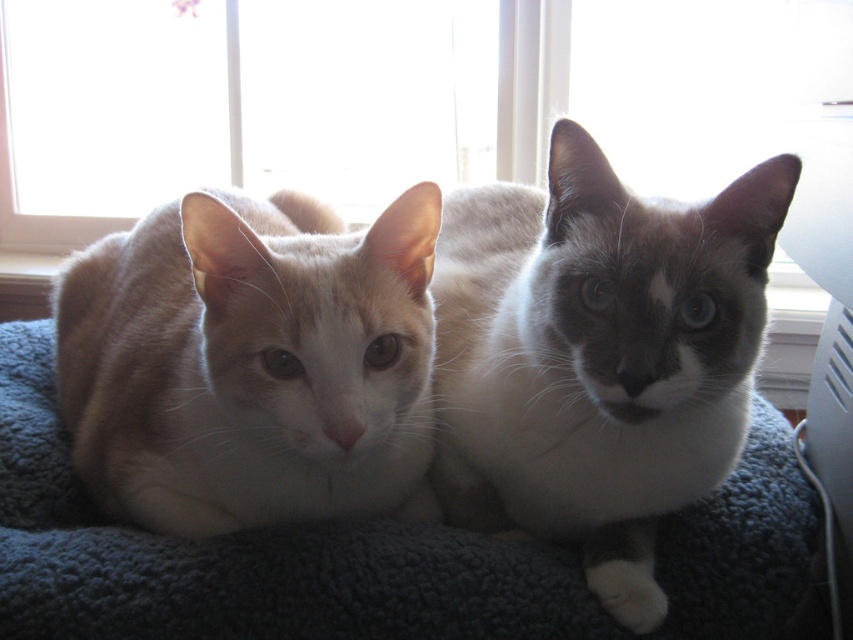
You are a photographer standing at the camera position. You want to take a closeup photo of the cats on the blue blanket. The focus point of your camera is set to point at point (618,413). If you move your camera closer to the cats by 10 inches, will the focus point still be on the cats?

The focus point at point (618,413) is currently 32.75 inches away from the camera. If you move the camera closer by 10 inches, the new distance becomes 22.75 inches. However, the focus point remains fixed at the original spatial coordinates. Moving the camera closer without adjusting the focus point may result in the cats being out of focus because the focus distance has changed. To maintain focus on the cats, you would need to recalibrate the focus point to the new distance of 22.75 inches.

In the scene shown: You are a photographer setting up a photo shoot on a dark blue fleece at center. You want to place a silky white cat at center on top of it for the shot. Will the cat fit vertically on the fleece without hanging off the edges?

The silky white cat at center is taller than the dark blue fleece at center, so placing it on top would cause part of the cat to hang off the fleece since the cat is taller.